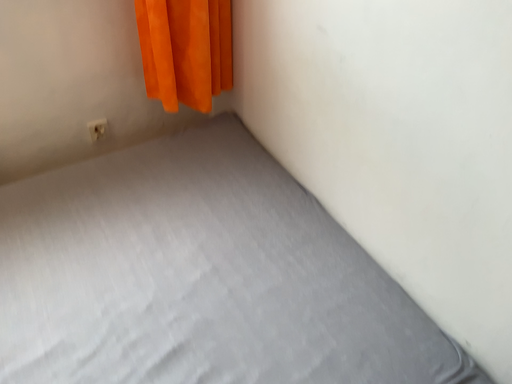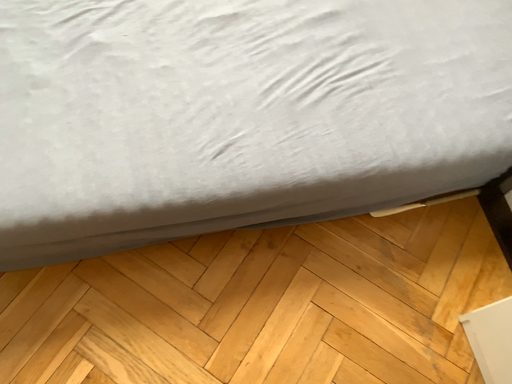
Question: How did the camera likely rotate when shooting the video?

Choices:
 (A) rotated upward
 (B) rotated downward

Answer: (B)